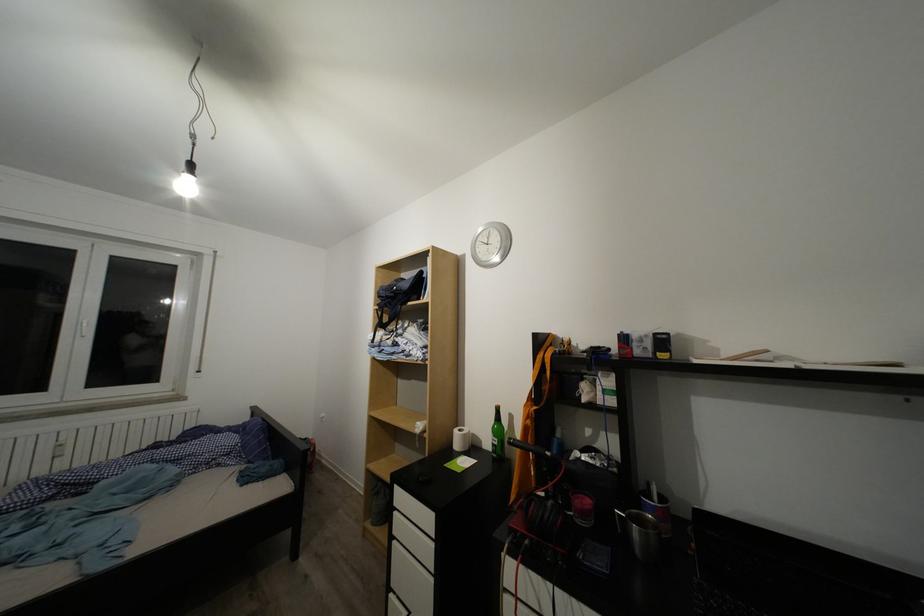
Describe the element at coordinates (84, 326) in the screenshot. This screenshot has height=616, width=924. I see `a white window handle` at that location.